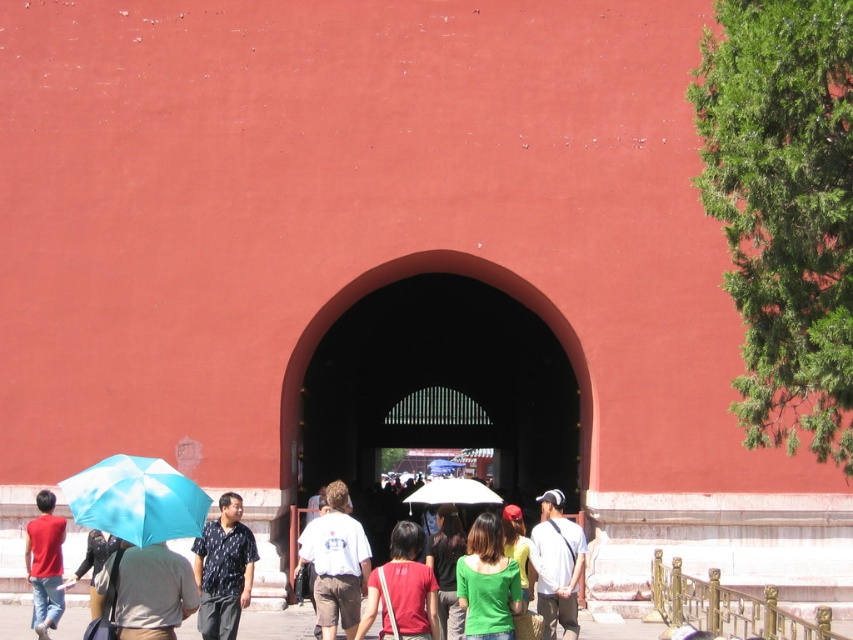
Question: Does green matte shirt at center appear on the left side of matte red shirt at lower left?

Choices:
 (A) yes
 (B) no

Answer: (B)

Question: Estimate the real-world distances between objects in this image. Which object is farther from the light brown fabric umbrella at lower left?

Choices:
 (A) white matte umbrella at center
 (B) green matte shirt at center
 (C) dark red stone archway at center

Answer: (C)

Question: Is white fabric shirt at center smaller than white matte umbrella at center?

Choices:
 (A) yes
 (B) no

Answer: (A)

Question: Which point is closer to the camera?

Choices:
 (A) (444, 557)
 (B) (164, 528)
 (C) (317, 536)

Answer: (B)

Question: Which object is positioned closest to the white matte umbrella at center?

Choices:
 (A) matte blue umbrella at lower left
 (B) white fabric shirt at center
 (C) printed cotton shirt at center
 (D) matte red shirt at lower left

Answer: (B)

Question: Is green matte shirt at center positioned behind matte red shirt at lower left?

Choices:
 (A) no
 (B) yes

Answer: (A)